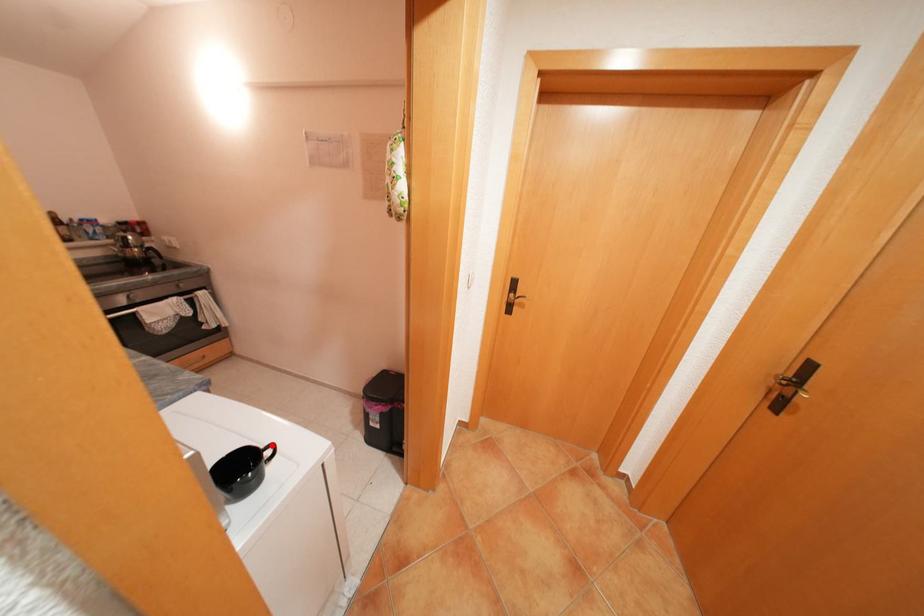
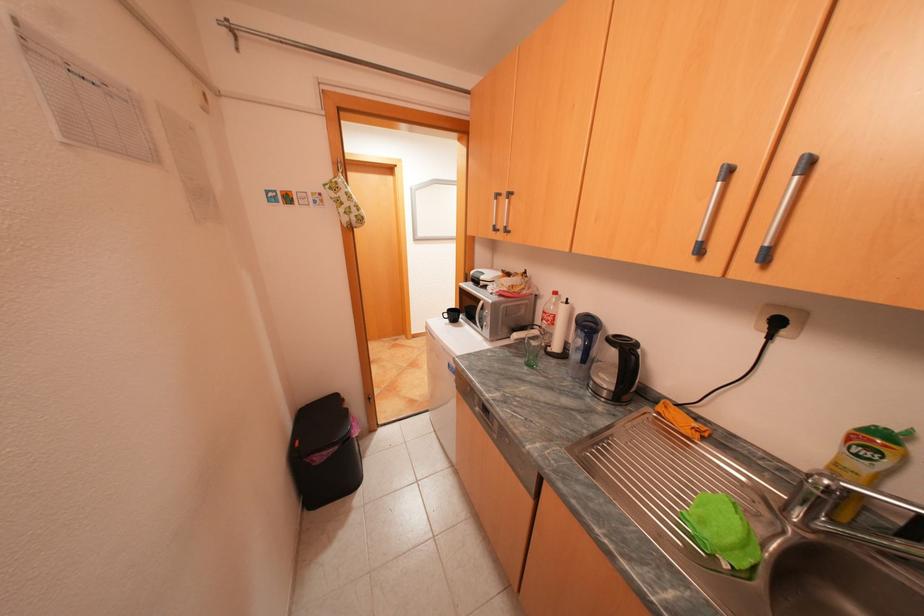
Question: I am providing you with two images of the same scene from different viewpoints. A red point is marked on the first image. At the location where the point appears in image 1, is it still visible in image 2?

Choices:
 (A) Yes
 (B) No

Answer: (B)